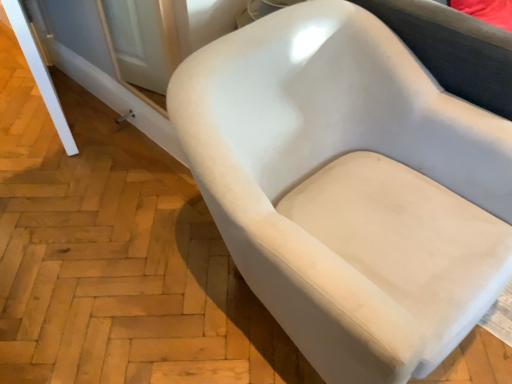
What do you see at coordinates (333, 193) in the screenshot?
I see `white fabric chair at center` at bounding box center [333, 193].

Find the location of `white fabric chair at center`. white fabric chair at center is located at coordinates (333, 193).

At what (x,y) coordinates should I click in order to perform the action: click on white fabric chair at center. Please return your answer as a coordinate pair (x, y). The height and width of the screenshot is (384, 512). Looking at the image, I should click on (333, 193).